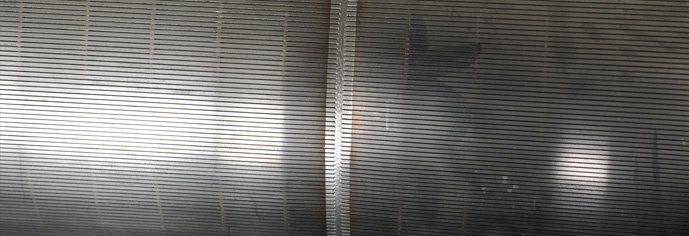
You are a GUI agent. You are given a task and a screenshot of the screen. Output one action in this format:
    pyautogui.click(x=<x>, y=<y>)
    Task: Click on the light reflection on blinds
    This screenshot has width=689, height=236.
    Given the screenshot: What is the action you would take?
    pyautogui.click(x=8, y=96)